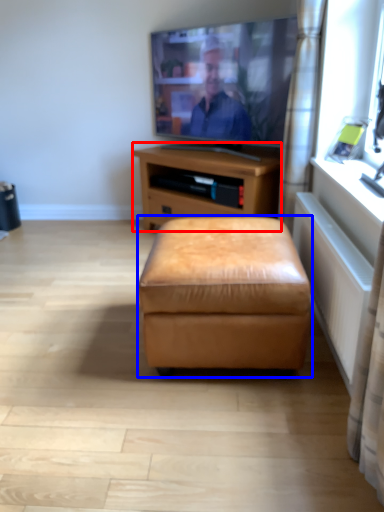
Question: Which object appears farthest to the camera in this image, nightstand (highlighted by a red box) or stool (highlighted by a blue box)?

Choices:
 (A) nightstand
 (B) stool

Answer: (A)